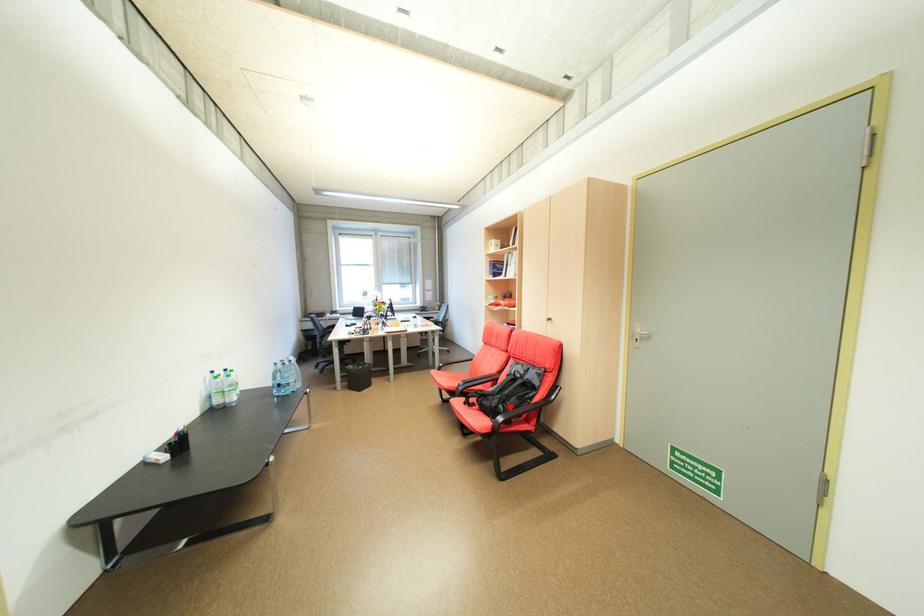
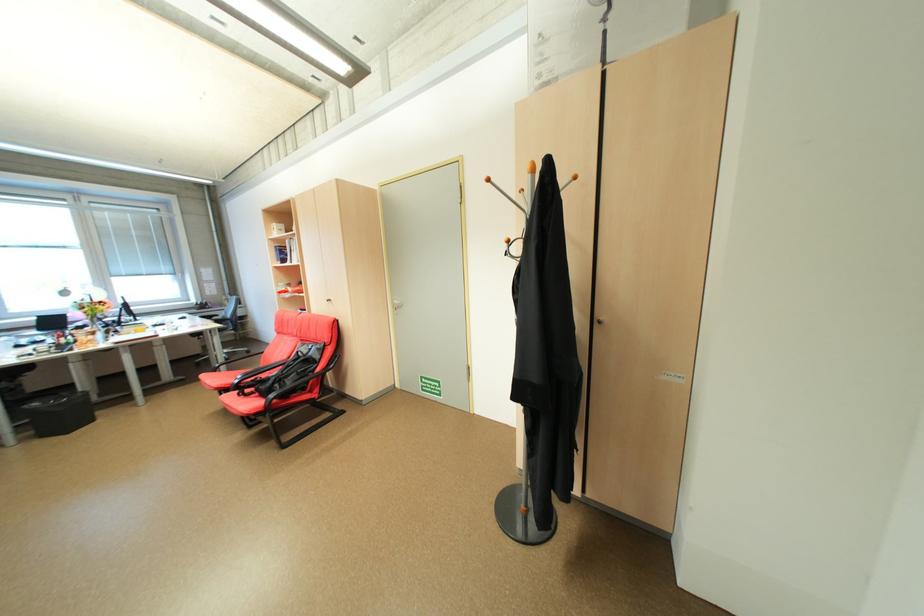
Locate, in the second image, the point that corresponds to the highlighted location in the first image.

(286, 386)